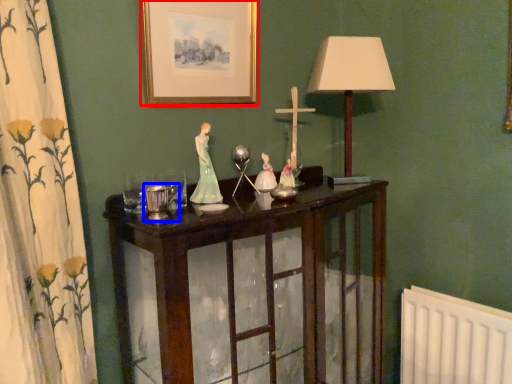
Question: Among these objects, which one is farthest to the camera, picture frame (highlighted by a red box) or candle holder (highlighted by a blue box)?

Choices:
 (A) picture frame
 (B) candle holder

Answer: (A)